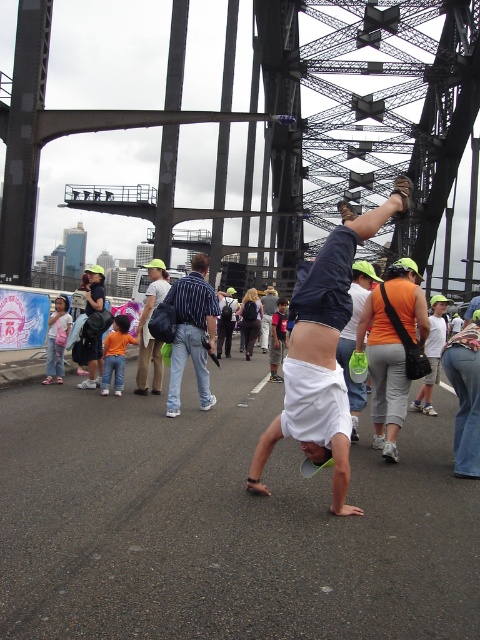
Who is taller, black steel bridge at center or striped shirt at center?

black steel bridge at center

The height and width of the screenshot is (640, 480). What do you see at coordinates (276, 125) in the screenshot?
I see `black steel bridge at center` at bounding box center [276, 125].

Identify the location of black steel bridge at center. (276, 125).